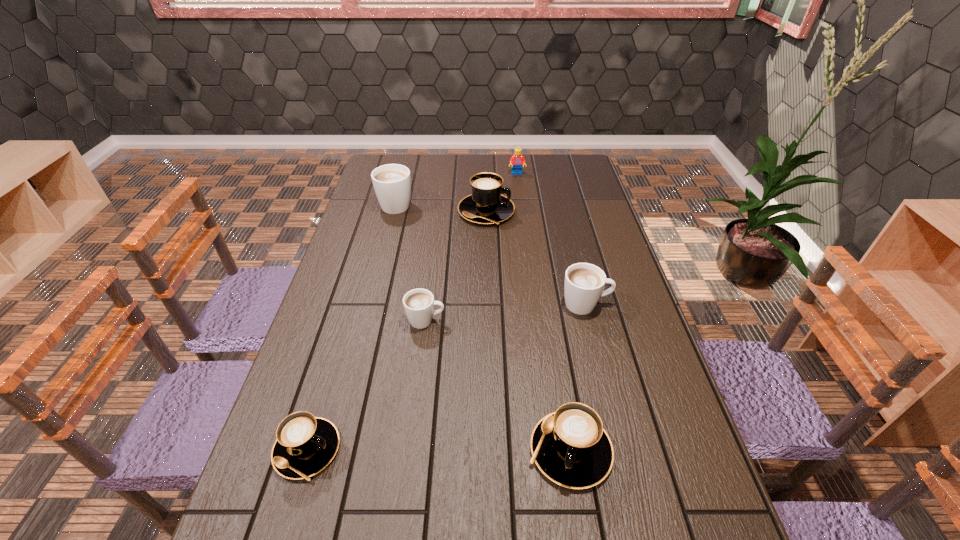
You are a GUI agent. You are given a task and a screenshot of the screen. Output one action in this format:
    pyautogui.click(x=<x>, y=<y>)
    Task: Click on the free spot located 0.180m with the handle on the side of the leftmost white cappuccino
    The width and height of the screenshot is (960, 540).
    Given the screenshot: What is the action you would take?
    click(x=405, y=168)

You are a GUI agent. You are given a task and a screenshot of the screen. Output one action in this format:
    pyautogui.click(x=<x>, y=<y>)
    Task: Click on the free space located 0.100m with the handle on the side of the leftmost white cappuccino
    The width and height of the screenshot is (960, 540).
    Given the screenshot: What is the action you would take?
    pyautogui.click(x=403, y=178)

Locate an element on the screen. The image size is (960, 540). vacant position located on the right of the biggest black cappuccino is located at coordinates (561, 212).

Locate an element on the screen. vacant space positioned 0.380m on the face of the farthest object is located at coordinates (524, 231).

The image size is (960, 540). Find the location of `vacant space located with the handle on the side of the second biggest white cappuccino`. vacant space located with the handle on the side of the second biggest white cappuccino is located at coordinates (632, 305).

Where is `free region located on the right of the second smallest black cappuccino`? Image resolution: width=960 pixels, height=540 pixels. free region located on the right of the second smallest black cappuccino is located at coordinates (636, 450).

Locate an element on the screen. This screenshot has width=960, height=540. free space located 0.110m on the right of the leftmost black cappuccino is located at coordinates coord(391,450).

Locate an element on the screen. The height and width of the screenshot is (540, 960). vacant space situated 0.280m with the handle on the side of the smallest white cappuccino is located at coordinates (546, 320).

Locate an element on the screen. The width and height of the screenshot is (960, 540). object that is at the far edge is located at coordinates pos(517,160).

This screenshot has height=540, width=960. In order to click on object located in the right edge section of the desktop in this screenshot , I will do `click(584, 283)`.